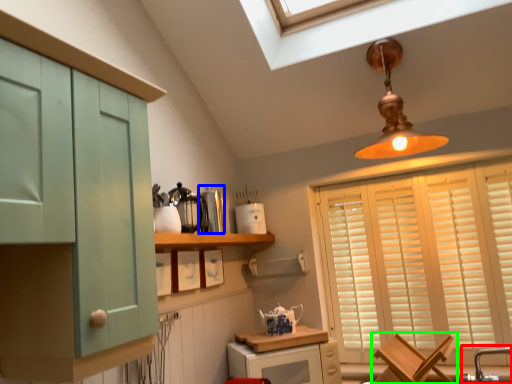
Question: Which object is the closest to the faucet (highlighted by a red box)? Choose among these: appliance (highlighted by a blue box) or chair (highlighted by a green box).

Choices:
 (A) appliance
 (B) chair

Answer: (B)